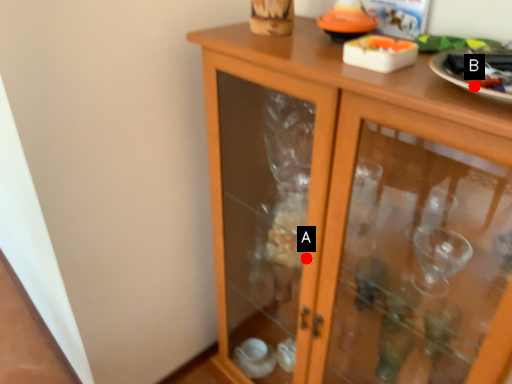
Question: Two points are circled on the image, labeled by A and B beside each circle. Which point is farther to the camera?

Choices:
 (A) A is further
 (B) B is further

Answer: (A)